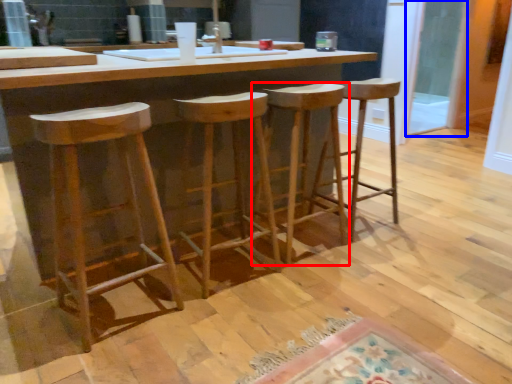
Question: Which object appears farthest to the camera in this image, stool (highlighted by a red box) or glass door (highlighted by a blue box)?

Choices:
 (A) stool
 (B) glass door

Answer: (B)